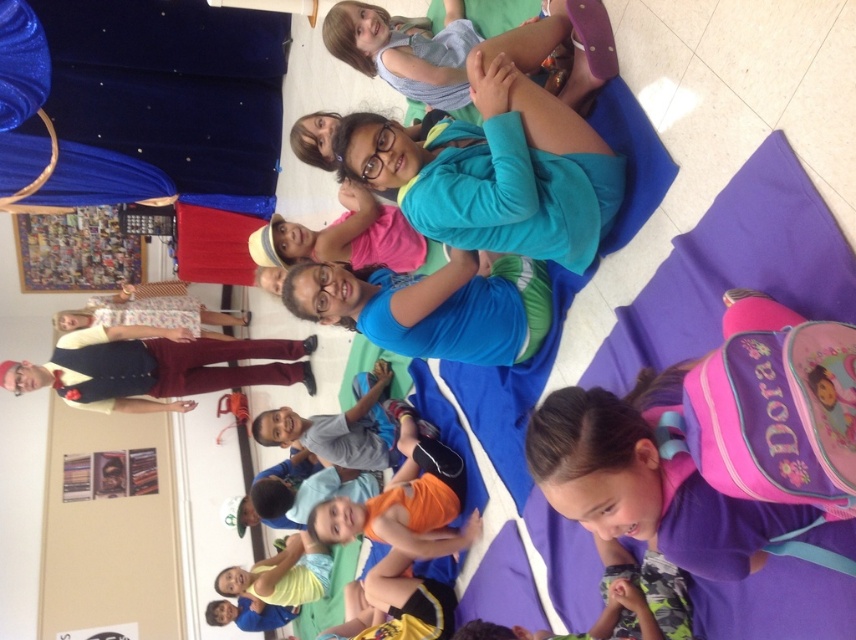
Question: Considering the real-world distances, which object is farthest from the blue fabric at center?

Choices:
 (A) maroon velvet pants at left
 (B) purple fabric backpack at lower right
 (C) blue denim dress at upper center

Answer: (A)

Question: Which point is farther to the camera?

Choices:
 (A) (468, 349)
 (B) (85, 369)
 (C) (670, 531)
 (D) (363, 52)

Answer: (B)

Question: Can you confirm if purple fabric backpack at lower right is thinner than blue fabric at center?

Choices:
 (A) no
 (B) yes

Answer: (B)

Question: Does blue fabric at center have a lesser width compared to maroon velvet pants at left?

Choices:
 (A) yes
 (B) no

Answer: (A)

Question: Estimate the real-world distances between objects in this image. Which object is closer to the maroon velvet pants at left?

Choices:
 (A) blue denim dress at upper center
 (B) blue fabric at center

Answer: (B)

Question: Does maroon velvet pants at left have a greater width compared to blue denim dress at upper center?

Choices:
 (A) yes
 (B) no

Answer: (A)